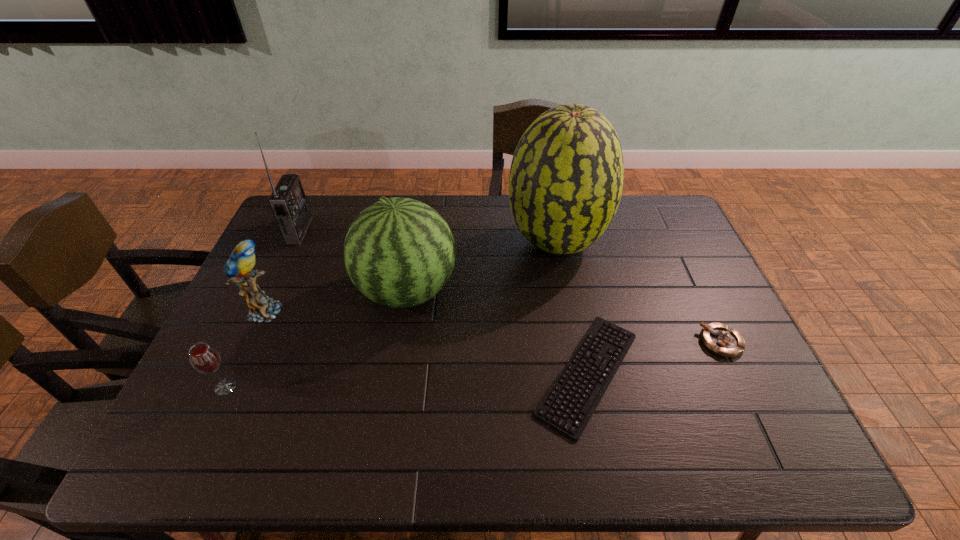
Where is `free space between the second shortest object and the radio receiver`? free space between the second shortest object and the radio receiver is located at coordinates (510, 286).

Find the location of a particular element. Image resolution: width=960 pixels, height=540 pixels. free area in between the radio receiver and the ashtray is located at coordinates (510, 286).

I want to click on free spot between the radio receiver and the ashtray, so (x=510, y=286).

I want to click on vacant area that lies between the fourth shortest object and the fourth object from left to right, so click(x=336, y=301).

In order to click on vacant area between the ashtray and the radio receiver in this screenshot , I will do `click(510, 286)`.

Identify the location of vacant point located between the taller watermelon and the computer keyboard. The width and height of the screenshot is (960, 540). (572, 307).

Where is `vacant space that's between the tallest object and the ashtray`? Image resolution: width=960 pixels, height=540 pixels. vacant space that's between the tallest object and the ashtray is located at coordinates (638, 292).

Find the location of a particular element. This screenshot has height=540, width=960. vacant area that lies between the shorter watermelon and the shortest object is located at coordinates (497, 332).

Where is `vacant space that is in between the left watermelon and the computer keyboard`? Image resolution: width=960 pixels, height=540 pixels. vacant space that is in between the left watermelon and the computer keyboard is located at coordinates (497, 332).

Identify the location of free space between the fourth object from left to right and the third shortest object. This screenshot has height=540, width=960. (316, 339).